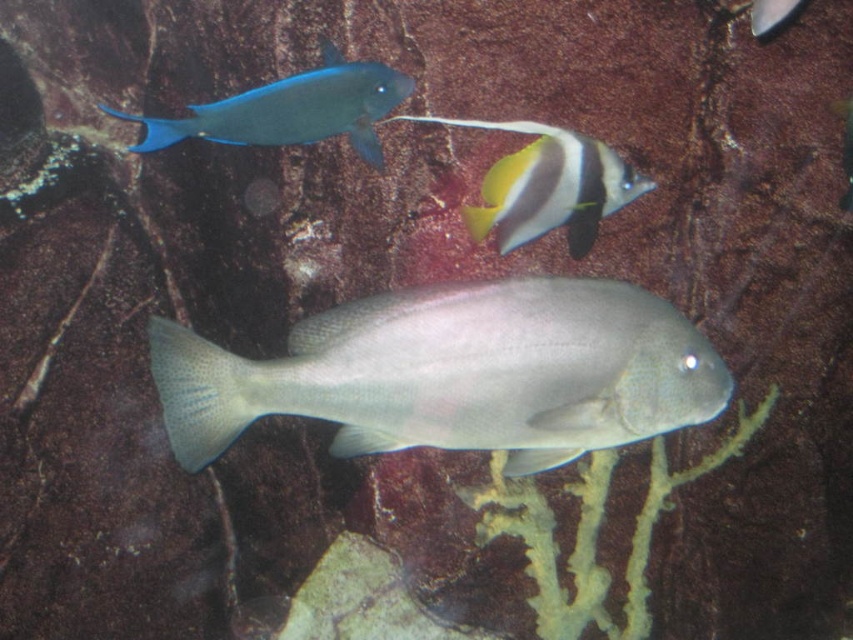
From the picture: Measure the distance between yellow-black striped fin at center and camera.

They are 1.51 meters apart.

Does yellow-black striped fin at center appear under shiny silver fish at upper right?

Yes.

Where is `yellow-black striped fin at center`? yellow-black striped fin at center is located at coordinates (548, 186).

Is shiny blue fish at upper left to the right of shiny silver fish at upper right from the viewer's perspective?

Incorrect, shiny blue fish at upper left is not on the right side of shiny silver fish at upper right.

Does shiny blue fish at upper left have a lesser width compared to shiny silver fish at upper right?

Incorrect, shiny blue fish at upper left's width is not less than shiny silver fish at upper right's.

Which is in front, point (257, 109) or point (766, 1)?

Positioned in front is point (257, 109).

I want to click on shiny blue fish at upper left, so click(291, 109).

Is point (368, 317) closer to camera compared to point (769, 24)?

Yes, it is.

Between point (175, 339) and point (764, 13), which one is positioned behind?

Point (764, 13)

Locate an element on the screen. The image size is (853, 640). satin silver fish at center is located at coordinates (456, 372).